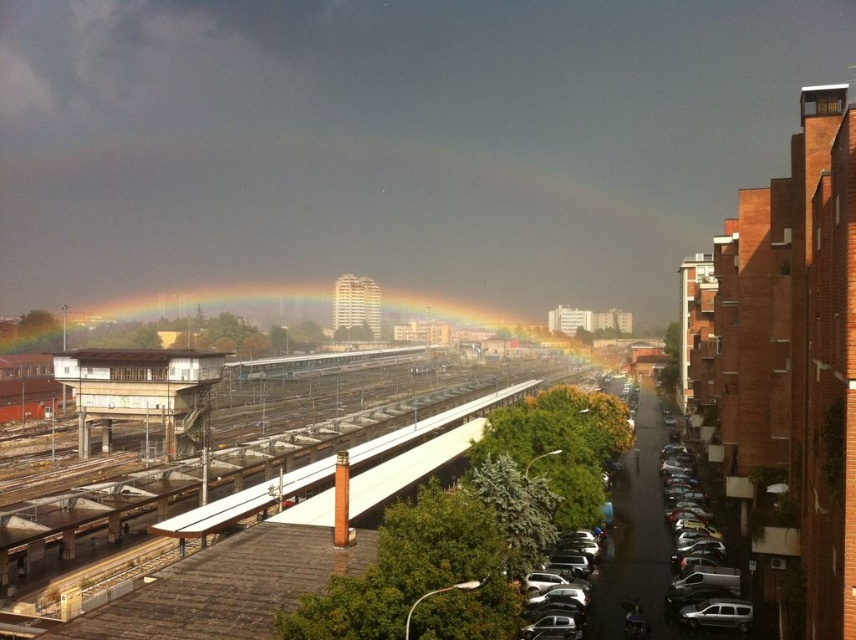
Is point (186, 392) farther from camera compared to point (560, 616)?

Yes, point (186, 392) is behind point (560, 616).

Which is behind, point (201, 362) or point (568, 637)?

Positioned behind is point (201, 362).

Describe the element at coordinates (141, 390) in the screenshot. I see `brown wooden railway station at center-left` at that location.

This screenshot has width=856, height=640. I want to click on brown wooden railway station at center-left, so click(141, 390).

Is silver metallic car at lower right shorter than metallic silver train at center?

Yes, silver metallic car at lower right is shorter than metallic silver train at center.

Does silver metallic car at lower right have a lesser width compared to metallic silver train at center?

Correct, silver metallic car at lower right's width is less than metallic silver train at center's.

Which is behind, point (527, 609) or point (299, 369)?

The point (299, 369) is behind.

You are a GUI agent. You are given a task and a screenshot of the screen. Output one action in this format:
    pyautogui.click(x=<x>, y=<y>)
    Task: Click on the silver metallic car at lower right
    
    Given the screenshot: What is the action you would take?
    pyautogui.click(x=559, y=596)

Who is lower down, brown wooden railway station at center-left or metallic silver train at center?

metallic silver train at center is below.

Based on the photo, does brown wooden railway station at center-left come in front of metallic silver train at center?

Yes, brown wooden railway station at center-left is in front of metallic silver train at center.

Who is more forward, (82, 371) or (387, 349)?

Positioned in front is point (82, 371).

You are a GUI agent. You are given a task and a screenshot of the screen. Output one action in this format:
    pyautogui.click(x=<x>, y=<y>)
    Task: Click on the brown wooden railway station at center-left
    The height and width of the screenshot is (640, 856).
    Given the screenshot: What is the action you would take?
    pyautogui.click(x=141, y=390)